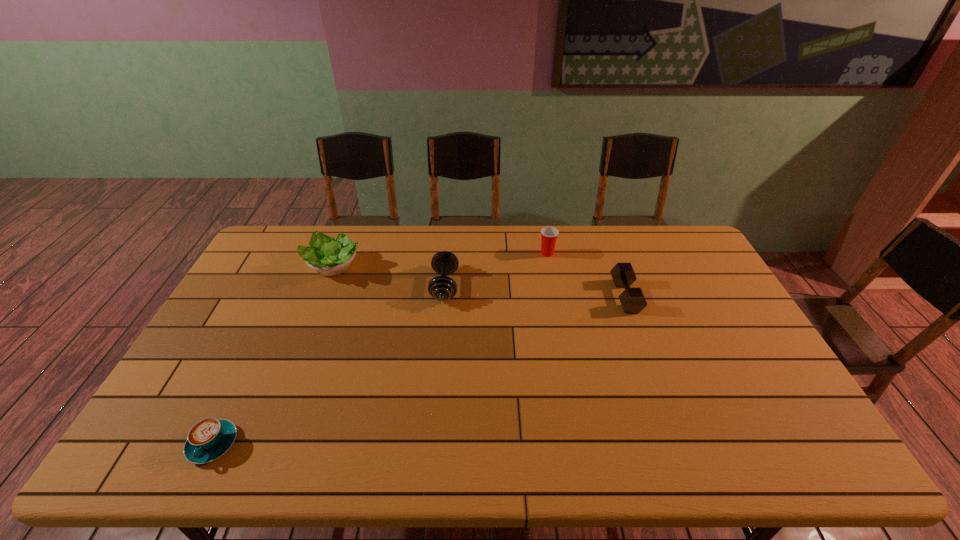
This screenshot has height=540, width=960. I want to click on free spot located on the left of the taller dumbbell, so click(x=325, y=286).

Where is `free space located 0.210m on the back of the shorter dumbbell`? This screenshot has width=960, height=540. free space located 0.210m on the back of the shorter dumbbell is located at coordinates (606, 242).

Find the location of a particular element. lettuce situated at the far edge is located at coordinates (328, 256).

Image resolution: width=960 pixels, height=540 pixels. I want to click on Dixie cup that is at the far edge, so click(x=549, y=235).

Identify the location of dumbbell that is at the far edge. This screenshot has width=960, height=540. (442, 288).

The image size is (960, 540). What are the coordinates of `object situated at the near edge` in the screenshot? It's located at pyautogui.click(x=210, y=438).

Find the location of `object situated at the left edge`. object situated at the left edge is located at coordinates (210, 438).

Identify the location of object present at the near left corner. This screenshot has width=960, height=540. (210, 438).

Locate an element on the screen. The image size is (960, 540). free space at the far edge of the desktop is located at coordinates (453, 225).

In order to click on vacant space at the left edge of the desktop in this screenshot , I will do (251, 281).